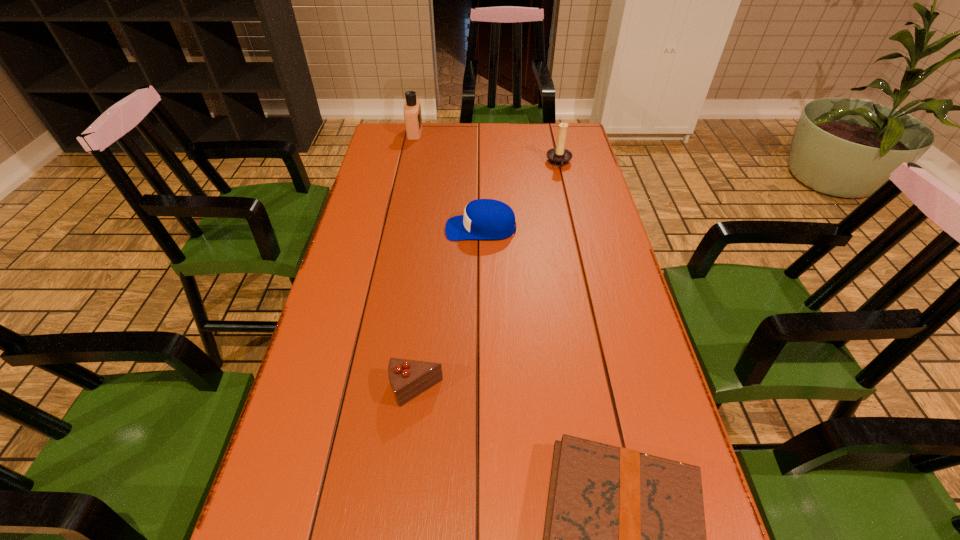
This screenshot has height=540, width=960. Find the location of `the farthest object`. the farthest object is located at coordinates (412, 109).

The image size is (960, 540). I want to click on perfume, so click(412, 109).

This screenshot has height=540, width=960. I want to click on candle holder, so click(x=558, y=156).

Identify the location of the third farthest object. (484, 219).

The image size is (960, 540). I want to click on the fourth farthest object, so click(408, 378).

You are a GUI agent. You are given a task and a screenshot of the screen. Output one action in this format:
    pyautogui.click(x=<x>, y=<y>)
    Task: Click on the vacant space located 0.170m on the front label of the perfume
    This screenshot has width=960, height=540.
    Given the screenshot: What is the action you would take?
    pyautogui.click(x=465, y=133)

The height and width of the screenshot is (540, 960). I want to click on vacant space positioned on the wick of the second farthest object, so pos(521,163).

The height and width of the screenshot is (540, 960). I want to click on blank area located 0.260m on the wick of the second farthest object, so click(x=475, y=163).

Where is `vacant space located 0.220m on the wick of the second farthest object`? This screenshot has height=540, width=960. vacant space located 0.220m on the wick of the second farthest object is located at coordinates (486, 163).

Locate an element on the screen. vacant region located 0.170m on the front-facing side of the third nearest object is located at coordinates (391, 228).